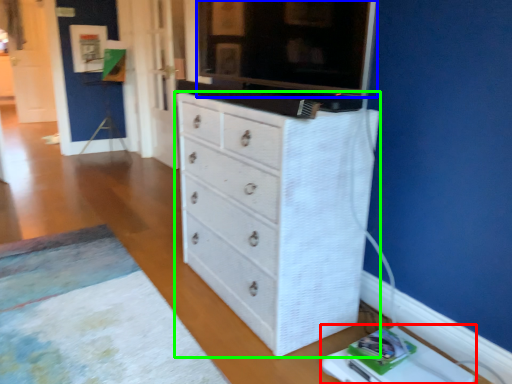
Question: Which object is the farthest from changing table (highlighted by a red box)? Choose among these: tv cabinet (highlighted by a blue box) or chest of drawers (highlighted by a green box).

Choices:
 (A) tv cabinet
 (B) chest of drawers

Answer: (A)